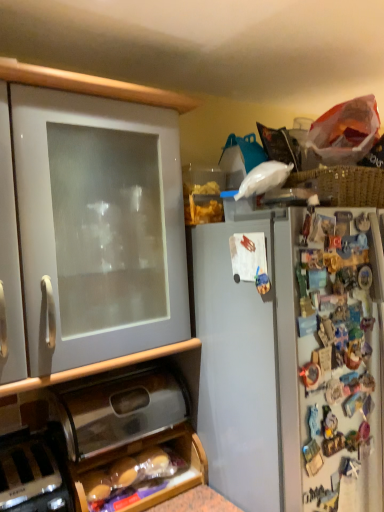
Question: Is black plastic toaster at lower left facing away from white matte cabinet at left, the 1th cabinetry positioned from the top?

Choices:
 (A) yes
 (B) no

Answer: (B)

Question: From a real-world perspective, is black plastic toaster at lower left positioned over white matte cabinet at left, marked as the 2th cabinetry in a bottom-to-top arrangement, based on gravity?

Choices:
 (A) yes
 (B) no

Answer: (B)

Question: Is white matte cabinet at left, marked as the 2th cabinetry in a bottom-to-top arrangement, completely or partially inside black plastic toaster at lower left?

Choices:
 (A) yes
 (B) no

Answer: (B)

Question: Is black plastic toaster at lower left at the left side of white matte cabinet at left, the 1th cabinetry positioned from the top?

Choices:
 (A) no
 (B) yes

Answer: (B)

Question: Is black plastic toaster at lower left next to white matte cabinet at left, the 1th cabinetry positioned from the top, and touching it?

Choices:
 (A) yes
 (B) no

Answer: (B)

Question: Does black plastic toaster at lower left lie in front of white matte cabinet at left, marked as the 2th cabinetry in a bottom-to-top arrangement?

Choices:
 (A) no
 (B) yes

Answer: (A)

Question: Is metallic silver breadbox at lower center, the second cabinetry viewed from the top, placed right next to black plastic toaster at lower left?

Choices:
 (A) no
 (B) yes

Answer: (A)

Question: Does metallic silver breadbox at lower center, the first cabinetry from the bottom, come in front of black plastic toaster at lower left?

Choices:
 (A) no
 (B) yes

Answer: (A)

Question: From the image's perspective, would you say metallic silver breadbox at lower center, the second cabinetry viewed from the top, is positioned over black plastic toaster at lower left?

Choices:
 (A) yes
 (B) no

Answer: (A)

Question: Does metallic silver breadbox at lower center, the second cabinetry viewed from the top, have a larger size compared to black plastic toaster at lower left?

Choices:
 (A) yes
 (B) no

Answer: (A)

Question: From a real-world perspective, is metallic silver breadbox at lower center, the first cabinetry from the bottom, located beneath black plastic toaster at lower left?

Choices:
 (A) yes
 (B) no

Answer: (B)

Question: Does metallic silver breadbox at lower center, the first cabinetry from the bottom, come behind black plastic toaster at lower left?

Choices:
 (A) yes
 (B) no

Answer: (A)

Question: From the image's perspective, is black plastic toaster at lower left beneath metallic silver breadbox at lower center, the second cabinetry viewed from the top?

Choices:
 (A) no
 (B) yes

Answer: (B)